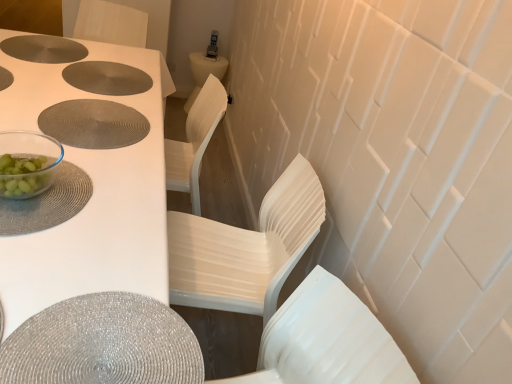
The image size is (512, 384). Identify the location of empty space that is ontop of matte gray placemat at upper left, the 1th hole in the top-to-bottom sequence (from a real-world perspective). (38, 43).